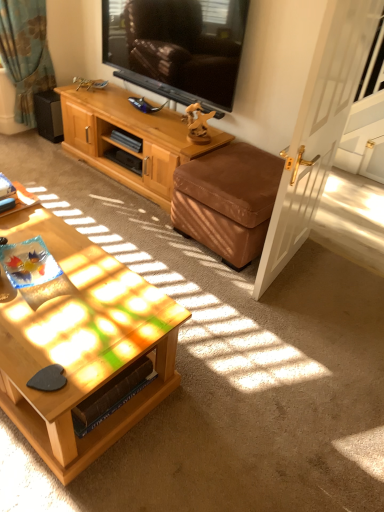
This screenshot has width=384, height=512. I want to click on vacant space in front of wooden desk at lower left, so click(15, 227).